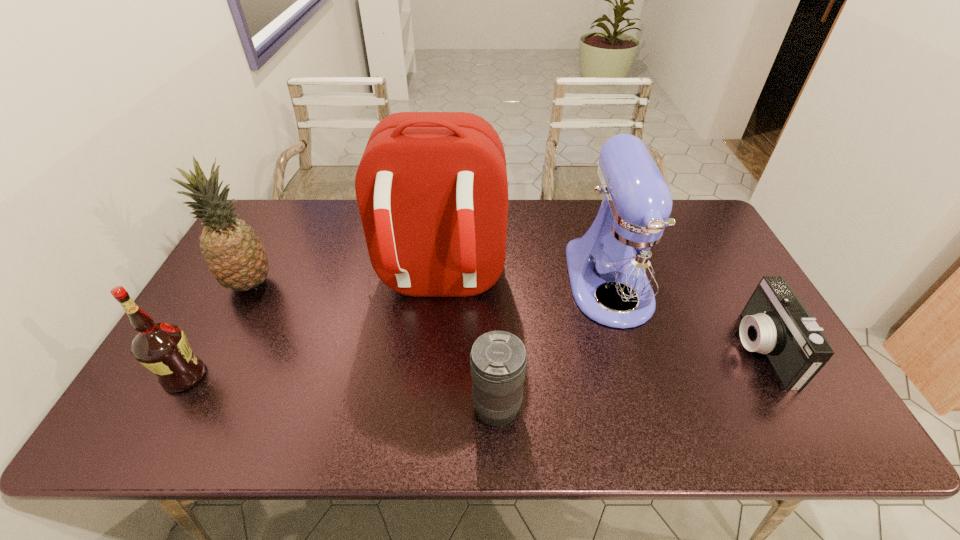
This screenshot has width=960, height=540. What are the coordinates of `free spot located on the label of the third shortest object` in the screenshot? It's located at (300, 376).

The width and height of the screenshot is (960, 540). Identify the location of free space located on the side of the second shortest object where the control switches are located. (388, 408).

In order to click on vacant space positioned on the side of the second shortest object where the control switches are located in this screenshot , I will do `click(318, 408)`.

This screenshot has width=960, height=540. What are the coordinates of `free location located on the side of the second shortest object where the control switches are located` in the screenshot? It's located at (357, 408).

Identify the location of vacant space located 0.060m on the lens of the camcorder. (717, 348).

Image resolution: width=960 pixels, height=540 pixels. I want to click on blank space located on the lens of the camcorder, so click(607, 348).

At what (x,y) coordinates should I click in order to perform the action: click on vacant space situated on the lens of the camcorder. Please return your answer as a coordinate pair (x, y). Looking at the image, I should click on (623, 348).

Find the location of a particular element. Image resolution: width=960 pixels, height=540 pixels. object that is at the far edge is located at coordinates (627, 258).

This screenshot has width=960, height=540. Find the location of `object that is at the near edge`. object that is at the near edge is located at coordinates (498, 360).

This screenshot has width=960, height=540. Identify the location of pineapple at the left edge. (235, 256).